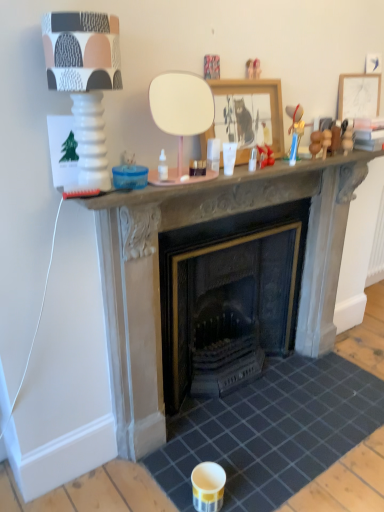
Find the location of `free point below matte white lamp at upper left (from a real-world perspective)`. free point below matte white lamp at upper left (from a real-world perspective) is located at coordinates (92, 186).